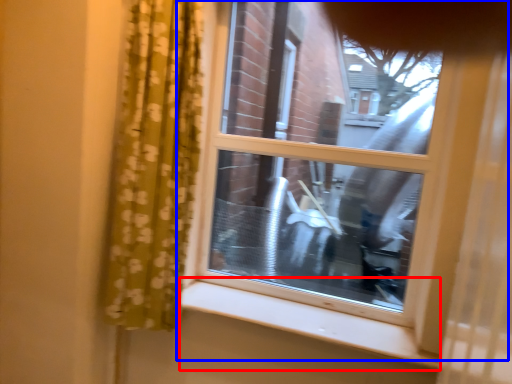
Question: Which of the following is the farthest to the observer, window sill (highlighted by a red box) or window (highlighted by a blue box)?

Choices:
 (A) window sill
 (B) window

Answer: (B)